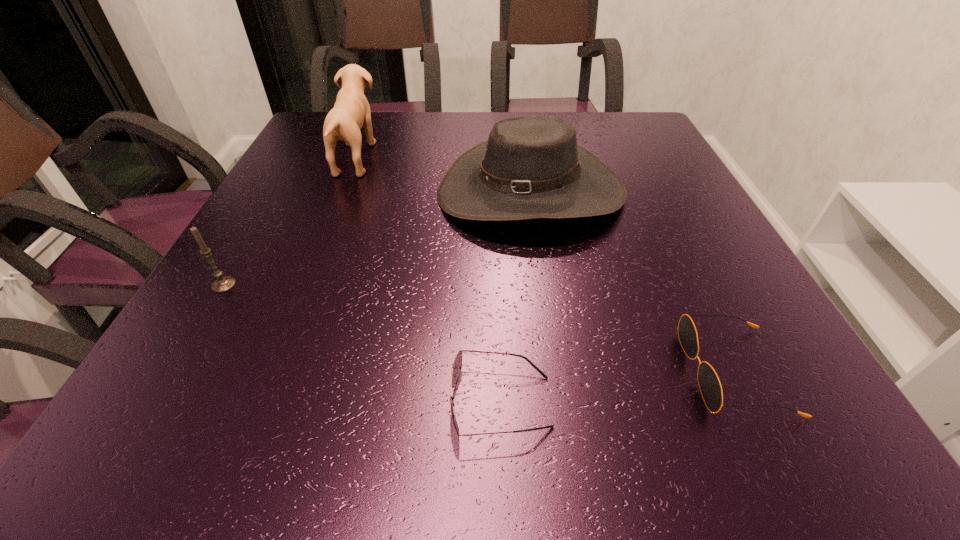
Where is `the second object from left to right`? The width and height of the screenshot is (960, 540). the second object from left to right is located at coordinates (351, 111).

Image resolution: width=960 pixels, height=540 pixels. Identify the location of cowboy hat. 531,167.

Where is `candle`? This screenshot has height=540, width=960. candle is located at coordinates pyautogui.click(x=222, y=284).

Where is `the third tallest object`? the third tallest object is located at coordinates tap(222, 284).

Image resolution: width=960 pixels, height=540 pixels. What are the coordinates of `the right sunglasses` in the screenshot? It's located at (709, 383).

Identify the location of the left sunglasses. This screenshot has width=960, height=540. (457, 365).

This screenshot has height=540, width=960. Find the location of `vacant area located 0.070m on the left side of the puppy`. vacant area located 0.070m on the left side of the puppy is located at coordinates (401, 158).

In order to click on free spot located 0.290m on the front-facing side of the cowboy hat in this screenshot , I will do `click(555, 362)`.

Find the location of a particular element. This screenshot has width=960, height=540. free space located on the right of the candle is located at coordinates (285, 285).

At what (x,y) coordinates should I click in order to perform the action: click on free space located 0.050m on the front-facing side of the right sunglasses. Please return your answer as a coordinate pair (x, y). This screenshot has height=540, width=960. Looking at the image, I should click on (655, 372).